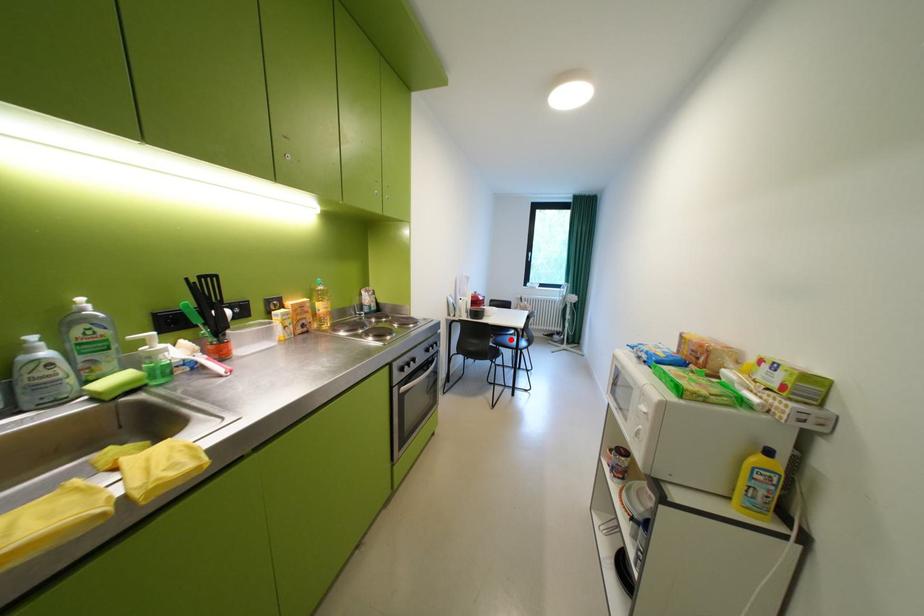
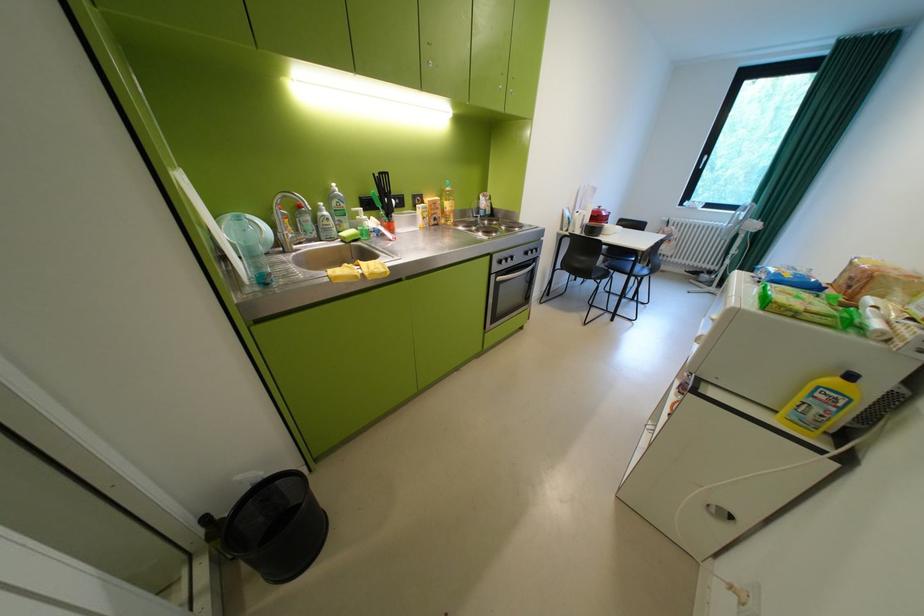
Question: I am providing you with two images of the same scene from different viewpoints. A red point is shown in image1. For the corresponding object point in image2, is it positioned nearer or farther from the camera?

Choices:
 (A) Nearer
 (B) Farther

Answer: (A)